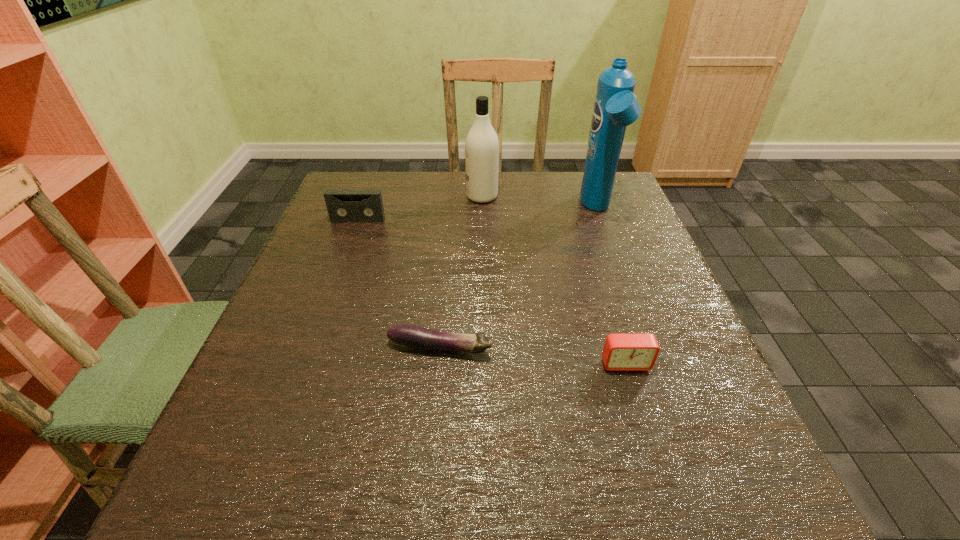
You are a GUI agent. You are given a task and a screenshot of the screen. Output one action in this format:
    pyautogui.click(x=<x>, y=<y>)
    Task: Click on the blank space at the near edge of the desktop
    
    Given the screenshot: What is the action you would take?
    pyautogui.click(x=458, y=465)

The height and width of the screenshot is (540, 960). In the image, there is a desktop. What are the coordinates of `vacant space at the left edge` in the screenshot? It's located at pos(244,442).

Where is `vacant space at the right edge of the desktop`? The height and width of the screenshot is (540, 960). vacant space at the right edge of the desktop is located at coordinates (582, 217).

You are a GUI agent. You are given a task and a screenshot of the screen. Output one action in this format:
    pyautogui.click(x=<x>, y=<y>)
    Task: Click on the free region at the far left corner of the desktop
    This screenshot has height=540, width=960.
    Given the screenshot: What is the action you would take?
    391,192

Locate an element on the screen. The image size is (960, 540). free space at the near left corner is located at coordinates (261, 464).

This screenshot has width=960, height=540. I want to click on free location at the near right corner, so point(716,482).

You are a GUI agent. You are given a task and a screenshot of the screen. Output one action in this format:
    pyautogui.click(x=<x>, y=<y>)
    Task: Click on the vacant space that is in between the eggplant and the left shampoo
    The image size is (960, 540).
    Given the screenshot: What is the action you would take?
    pyautogui.click(x=461, y=272)

Find the location of a particular element. Image resolution: width=960 pixels, height=540 pixels. vacant space that's between the videotape and the tallest object is located at coordinates (478, 215).

Where is `free point between the shortest object and the shorter shampoo`? The image size is (960, 540). free point between the shortest object and the shorter shampoo is located at coordinates (461, 272).

At what (x,y) coordinates should I click in order to perform the action: click on blank region between the shorter shampoo and the eggplant. Please return your answer as a coordinate pair (x, y). Looking at the image, I should click on (461, 272).